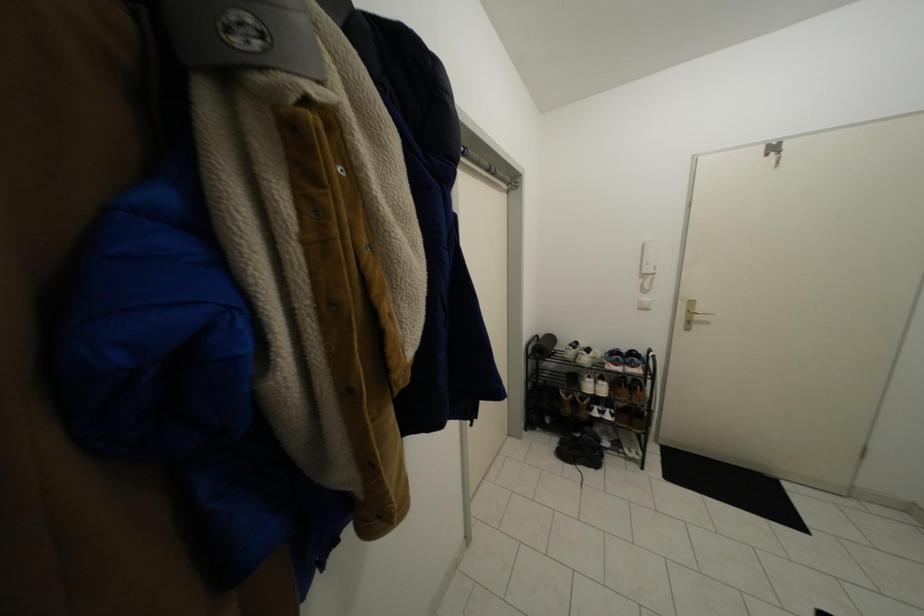
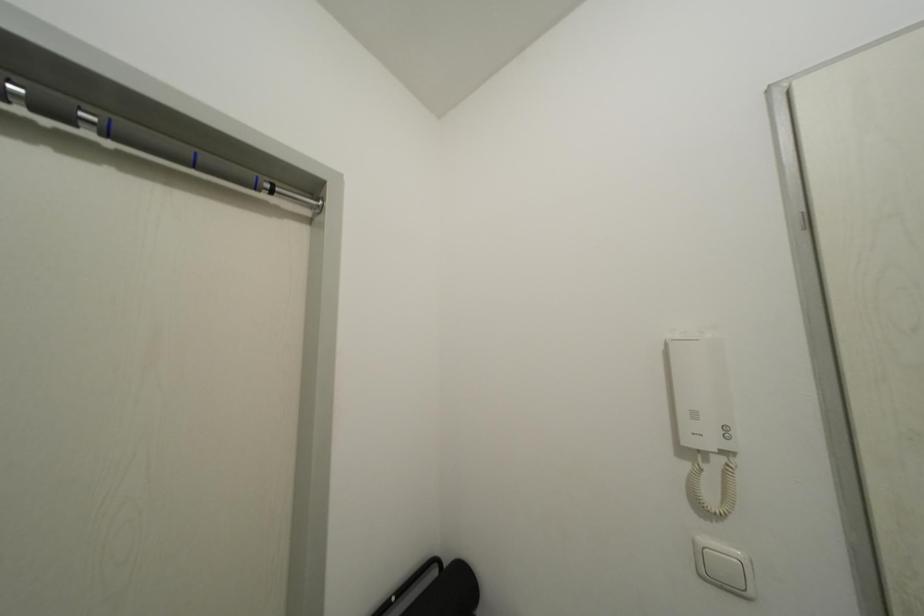
What movement of the cameraman would produce the second image?

The cameraman moved toward right, forward.